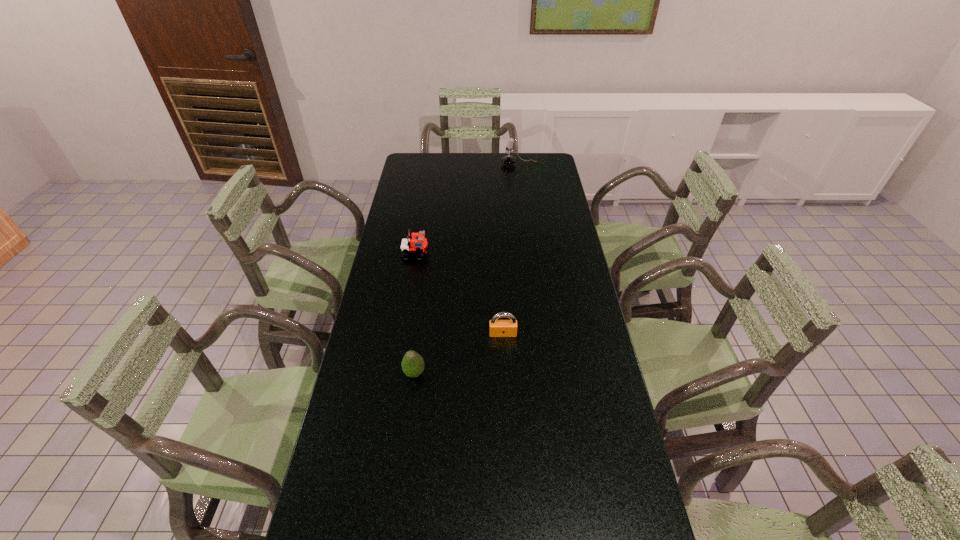
The image size is (960, 540). In order to click on microphone in this screenshot , I will do `click(508, 159)`.

Find the location of a particular element. The image size is (960, 540). the tallest object is located at coordinates 508,159.

What are the coordinates of `Lego` in the screenshot? It's located at (418, 245).

Image resolution: width=960 pixels, height=540 pixels. In order to click on the third farthest object in this screenshot , I will do `click(497, 328)`.

Locate an element on the screen. the nearest object is located at coordinates (412, 364).

Find the location of a particular element. free space located on the front of the tallest object is located at coordinates (521, 182).

At what (x,y) coordinates should I click in order to perform the action: click on free space located 0.380m on the front-facing side of the Lego. Please return your answer as a coordinate pair (x, y). The height and width of the screenshot is (540, 960). Looking at the image, I should click on (530, 254).

Locate an element on the screen. vacant space situated 0.290m to unlock the third farthest object from the front is located at coordinates (507, 424).

At what (x,y) coordinates should I click in order to perform the action: click on vacant space situated on the right of the nearest object. Please return your answer as a coordinate pair (x, y). Looking at the image, I should click on (485, 373).

Identify the location of object that is at the far edge. This screenshot has width=960, height=540. (508, 159).